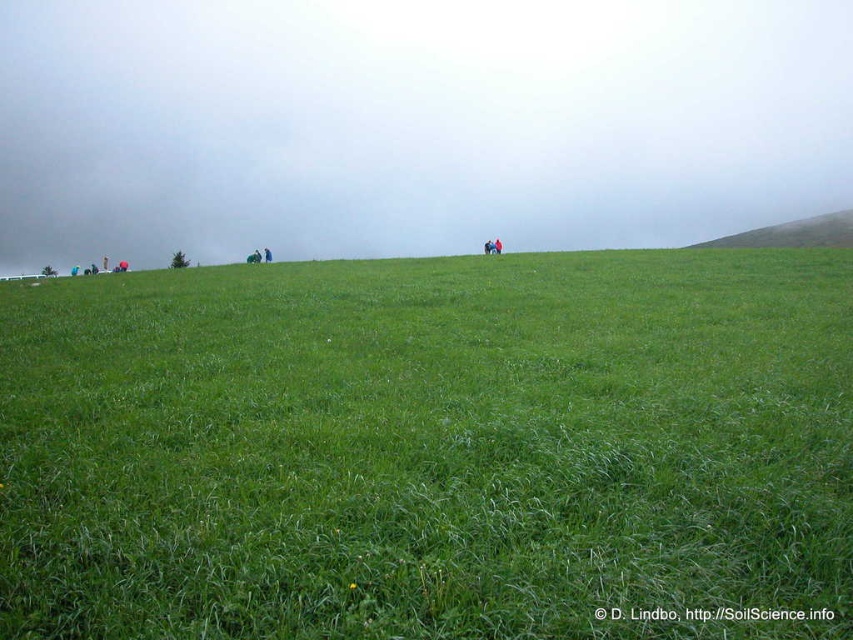
You are standing in the middle of the green grassy field at upper center and want to walk towards the green grassy hillside at upper right. Which direction should you head?

Since the green grassy field at upper center is closer to the viewer than the green grassy hillside at upper right, you should head towards the upper right direction to reach the hillside.